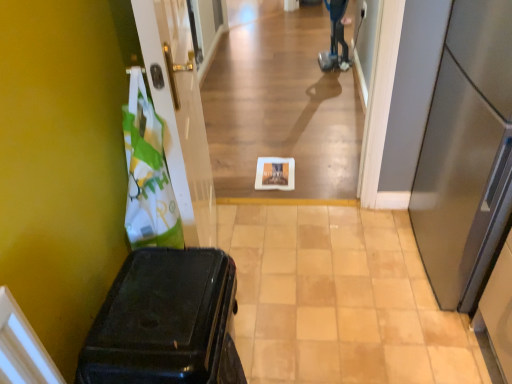
What do you see at coordinates (179, 113) in the screenshot?
I see `white glossy door at left, which is the 2th door from right to left` at bounding box center [179, 113].

Describe the element at coordinates (281, 104) in the screenshot. The image size is (512, 384). I see `white paper at center` at that location.

The image size is (512, 384). What do you see at coordinates (340, 299) in the screenshot? I see `white glossy plate at center` at bounding box center [340, 299].

Consider the image. Measure the distance between point (x=367, y=216) and camera.

The depth of point (x=367, y=216) is 6.66 feet.

Measure the distance between point (452, 6) and camera.

Point (452, 6) and camera are 1.46 meters apart.

Image resolution: width=512 pixels, height=384 pixels. What do you see at coordinates (466, 154) in the screenshot?
I see `satin silver refrigerator at right, the second door when ordered from left to right` at bounding box center [466, 154].

Find the location of `white glossy door at left, which appears as the 1th door when viewed from the left`. white glossy door at left, which appears as the 1th door when viewed from the left is located at coordinates tap(179, 113).

Consider the image. Considering the sizes of white paper at center and satin silver refrigerator at right, the second door when ordered from left to right, in the image, is white paper at center wider or thinner than satin silver refrigerator at right, the second door when ordered from left to right,?

white paper at center is thinner than satin silver refrigerator at right, the second door when ordered from left to right.

From the image's perspective, is white paper at center positioned above or below satin silver refrigerator at right, the second door when ordered from left to right?

white paper at center is above satin silver refrigerator at right, the second door when ordered from left to right.

From a real-world perspective, which object stands above the other?

From a 3D spatial view, satin silver refrigerator at right, the second door when ordered from left to right, is above.

Considering the sizes of objects shiny black suitcase at left and satin silver refrigerator at right, the second door when ordered from left to right, in the image provided, who is taller, shiny black suitcase at left or satin silver refrigerator at right, the second door when ordered from left to right,?

satin silver refrigerator at right, the second door when ordered from left to right, is taller.

Could you measure the distance between shiny black suitcase at left and satin silver refrigerator at right, the second door when ordered from left to right?

shiny black suitcase at left is 36.44 inches away from satin silver refrigerator at right, the second door when ordered from left to right.

What's the angular difference between shiny black suitcase at left and satin silver refrigerator at right, the second door when ordered from left to right,'s facing directions?

shiny black suitcase at left and satin silver refrigerator at right, the second door when ordered from left to right, are facing 180 degrees away from each other.

Considering the relative sizes of shiny black suitcase at left and satin silver refrigerator at right, acting as the 1th door starting from the right, in the image provided, is shiny black suitcase at left wider than satin silver refrigerator at right, acting as the 1th door starting from the right,?

In fact, shiny black suitcase at left might be narrower than satin silver refrigerator at right, acting as the 1th door starting from the right.

From the image's perspective, which one is positioned lower, satin silver refrigerator at right, the second door when ordered from left to right, or white glossy plate at center?

From the image's view, white glossy plate at center is below.

Is satin silver refrigerator at right, the second door when ordered from left to right, next to white glossy plate at center?

No, satin silver refrigerator at right, the second door when ordered from left to right, is not in contact with white glossy plate at center.

Based on the photo, which object is closer to the camera taking this photo, satin silver refrigerator at right, acting as the 1th door starting from the right, or white glossy plate at center?

satin silver refrigerator at right, acting as the 1th door starting from the right, is more forward.

Is satin silver refrigerator at right, the second door when ordered from left to right, turned away from white glossy plate at center?

No.

Does white glossy plate at center touch white glossy door at left, which is the 2th door from right to left?

There is a gap between white glossy plate at center and white glossy door at left, which is the 2th door from right to left.

Is white glossy plate at center to the left or to the right of white glossy door at left, which appears as the 1th door when viewed from the left, in the image?

Based on their positions, white glossy plate at center is located to the right of white glossy door at left, which appears as the 1th door when viewed from the left.

Is white glossy plate at center oriented away from white glossy door at left, which appears as the 1th door when viewed from the left?

No, white glossy plate at center is not facing the opposite direction of white glossy door at left, which appears as the 1th door when viewed from the left.

Is white glossy plate at center surrounding white glossy door at left, which appears as the 1th door when viewed from the left?

No, white glossy plate at center does not contain white glossy door at left, which appears as the 1th door when viewed from the left.

Is shiny black suitcase at left in front of or behind white glossy plate at center in the image?

Visually, shiny black suitcase at left is located in front of white glossy plate at center.

Would you say shiny black suitcase at left is a long distance from white glossy plate at center?

No, there isn't a large distance between shiny black suitcase at left and white glossy plate at center.

Is shiny black suitcase at left wider or thinner than white glossy plate at center?

Considering their sizes, shiny black suitcase at left looks slimmer than white glossy plate at center.

From a real-world perspective, relative to white glossy plate at center, is shiny black suitcase at left vertically above or below?

In terms of real-world spatial position, shiny black suitcase at left is above white glossy plate at center.

Between white glossy door at left, which appears as the 1th door when viewed from the left, and shiny black suitcase at left, which one appears on the right side from the viewer's perspective?

From the viewer's perspective, shiny black suitcase at left appears more on the right side.

Is point (191, 198) in front of point (168, 364)?

No, it is not.

Does white glossy door at left, which appears as the 1th door when viewed from the left, have a greater height compared to shiny black suitcase at left?

Indeed, white glossy door at left, which appears as the 1th door when viewed from the left, has a greater height compared to shiny black suitcase at left.

From a real-world perspective, starting from the shiny black suitcase at left, which door is the 2nd one vertically above it? Please provide its 2D coordinates.

[(179, 113)]

Which object is further away from the camera taking this photo, blue plastic mobility scooter at upper center or shiny black suitcase at left?

blue plastic mobility scooter at upper center.

Does point (338, 0) come behind point (193, 319)?

Yes, point (338, 0) is farther from viewer.

Is blue plastic mobility scooter at upper center beside shiny black suitcase at left?

They are not placed beside each other.

Which is more to the left, blue plastic mobility scooter at upper center or shiny black suitcase at left?

From the viewer's perspective, shiny black suitcase at left appears more on the left side.

From the image's perspective, count 2nd doors downward from the white paper at center and point to it. Please provide its 2D coordinates.

[(466, 154)]

From the shiny black suitcase at left, count 2nd doors backward and point to it. Please provide its 2D coordinates.

[(466, 154)]

From the image, which object appears to be nearer to white paper at center, blue plastic mobility scooter at upper center or satin silver refrigerator at right, acting as the 1th door starting from the right?

blue plastic mobility scooter at upper center is positioned closer to the anchor white paper at center.

Consider the image. Looking at the image, which one is located further to shiny black suitcase at left, satin silver refrigerator at right, the second door when ordered from left to right, or white glossy door at left, which appears as the 1th door when viewed from the left?

satin silver refrigerator at right, the second door when ordered from left to right.

From the picture: Estimate the real-world distances between objects in this image. Which object is closer to white glossy plate at center, satin silver refrigerator at right, acting as the 1th door starting from the right, or white glossy door at left, which is the 2th door from right to left?

Among the two, satin silver refrigerator at right, acting as the 1th door starting from the right, is located nearer to white glossy plate at center.

When comparing their distances from satin silver refrigerator at right, the second door when ordered from left to right, does white paper at center or white glossy door at left, which is the 2th door from right to left, seem closer?

The object closer to satin silver refrigerator at right, the second door when ordered from left to right, is white glossy door at left, which is the 2th door from right to left.

When comparing their distances from shiny black suitcase at left, does white paper at center or satin silver refrigerator at right, acting as the 1th door starting from the right, seem closer?

The object closer to shiny black suitcase at left is satin silver refrigerator at right, acting as the 1th door starting from the right.

Which object lies nearer to the anchor point white glossy plate at center, shiny black suitcase at left or satin silver refrigerator at right, the second door when ordered from left to right?

Based on the image, satin silver refrigerator at right, the second door when ordered from left to right, appears to be nearer to white glossy plate at center.

Estimate the real-world distances between objects in this image. Which object is further from shiny black suitcase at left, blue plastic mobility scooter at upper center or white paper at center?

The object further to shiny black suitcase at left is blue plastic mobility scooter at upper center.

Based on their spatial positions, is white paper at center or satin silver refrigerator at right, acting as the 1th door starting from the right, further from white glossy door at left, which appears as the 1th door when viewed from the left?

white paper at center.

Locate an element on the screen. This screenshot has height=384, width=512. suitcase located between white glossy door at left, which appears as the 1th door when viewed from the left, and satin silver refrigerator at right, acting as the 1th door starting from the right, in the left-right direction is located at coordinates (165, 322).

The width and height of the screenshot is (512, 384). What are the coordinates of `door between white glossy door at left, which appears as the 1th door when viewed from the left, and blue plastic mobility scooter at upper center in the front-back direction` in the screenshot? It's located at (466, 154).

Find the location of `corridor between shiny black suitcase at left and satin silver refrigerator at right, the second door when ordered from left to right`. corridor between shiny black suitcase at left and satin silver refrigerator at right, the second door when ordered from left to right is located at coordinates (281, 104).

The image size is (512, 384). What are the coordinates of `path positioned between shiny black suitcase at left and blue plastic mobility scooter at upper center from near to far` in the screenshot? It's located at (340, 299).